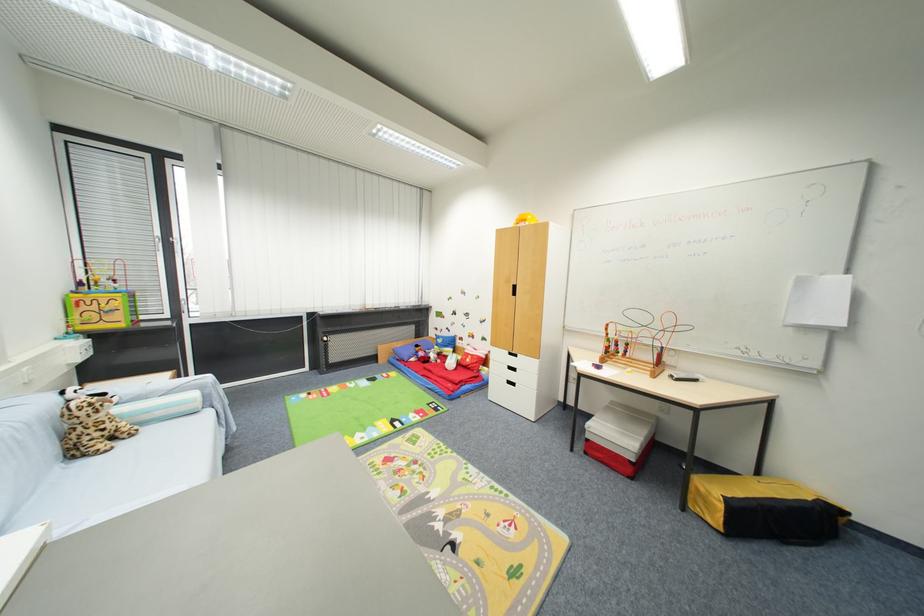
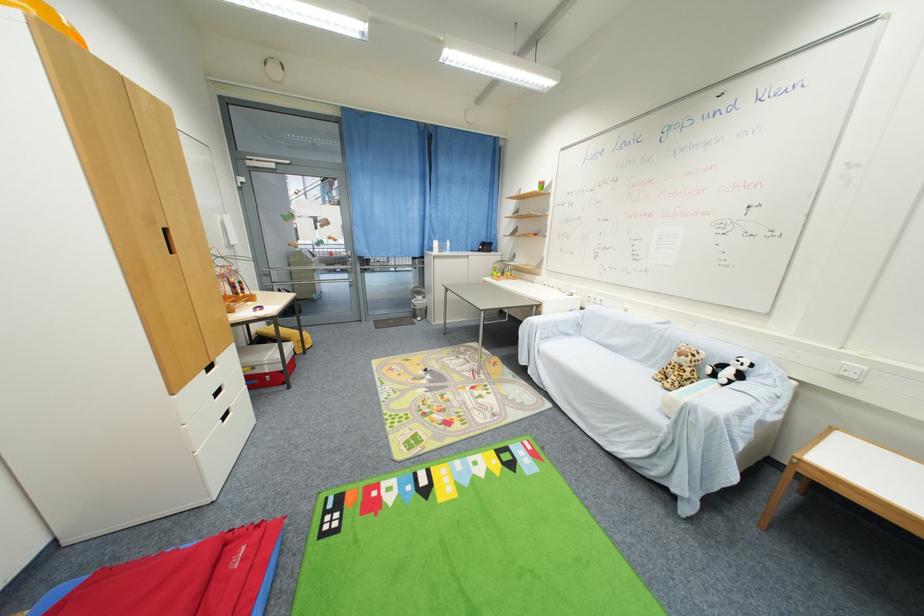
Find the pixel in the second image that matches the point at 129,431 in the first image.

(675, 382)